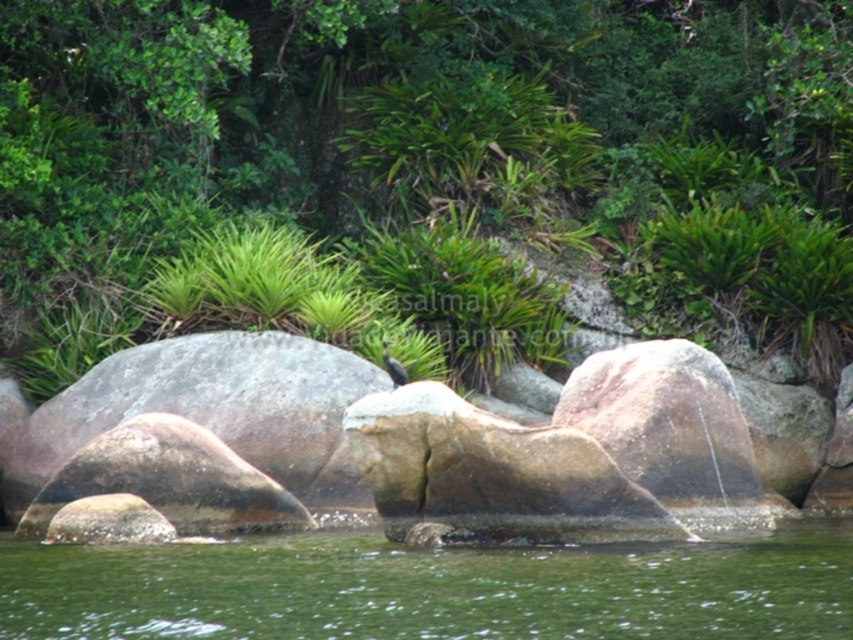
Question: Among these points, which one is nearest to the camera?

Choices:
 (A) (18, 627)
 (B) (700, 36)

Answer: (A)

Question: Can you confirm if green leafy tree at upper left is positioned above green water at center?

Choices:
 (A) no
 (B) yes

Answer: (B)

Question: From the image, what is the correct spatial relationship of green leafy tree at upper left in relation to green water at center?

Choices:
 (A) left
 (B) right

Answer: (A)

Question: Which point is farther to the camera?

Choices:
 (A) (560, 131)
 (B) (308, 588)

Answer: (A)

Question: Can you confirm if green leafy tree at upper left is smaller than green water at center?

Choices:
 (A) no
 (B) yes

Answer: (A)